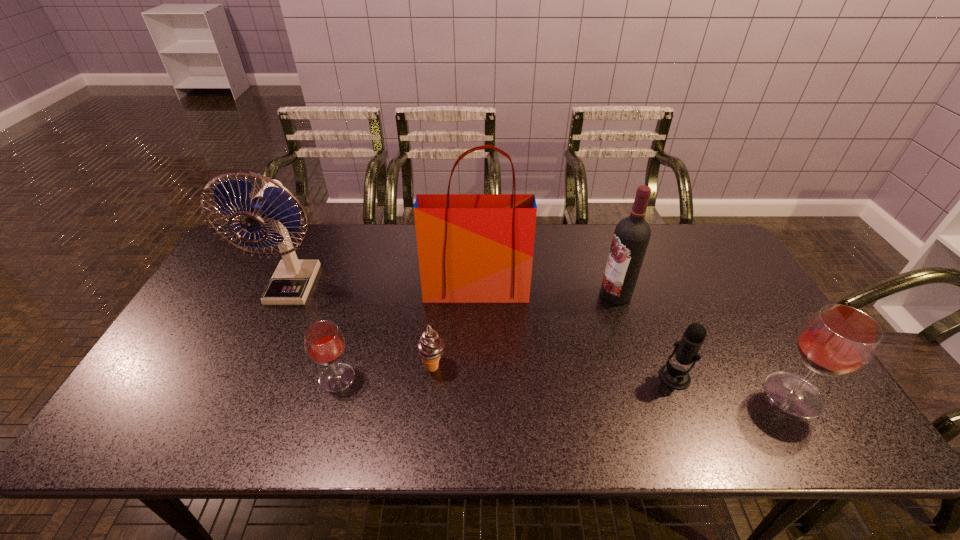
Find the location of a particular element. This screenshot has width=960, height=540. the shorter wineglass is located at coordinates (324, 343).

Image resolution: width=960 pixels, height=540 pixels. I want to click on the second object from left to right, so click(x=324, y=343).

The width and height of the screenshot is (960, 540). Find the location of `the rightmost object`. the rightmost object is located at coordinates (837, 340).

What are the coordinates of `the taller wineglass` in the screenshot? It's located at (837, 340).

Locate an element on the screen. This screenshot has width=960, height=540. fan is located at coordinates (292, 280).

Locate an element on the screen. Image resolution: width=960 pixels, height=540 pixels. shopping bag is located at coordinates (473, 248).

The image size is (960, 540). Find the location of `wine bottle`. wine bottle is located at coordinates click(x=632, y=234).

The height and width of the screenshot is (540, 960). I want to click on icecream, so click(x=430, y=347).

This screenshot has height=540, width=960. What are the coordinates of `microphone` in the screenshot? It's located at (674, 376).

I want to click on blank area located on the right of the sixth object from right to left, so click(x=407, y=378).